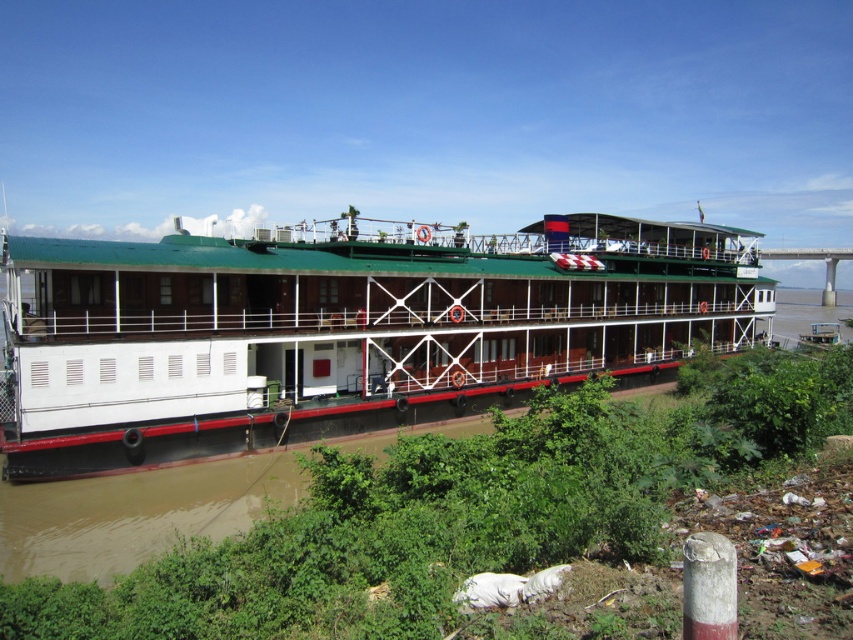
Is point (433, 342) positioned before point (190, 604)?

No, (433, 342) is further to viewer.

Can you confirm if white matte boat at center is shorter than green leafy vegetation at lower center?

In fact, white matte boat at center may be taller than green leafy vegetation at lower center.

Is point (666, 236) less distant than point (343, 513)?

That is False.

In order to click on white matte boat at center in this screenshot , I will do `click(344, 330)`.